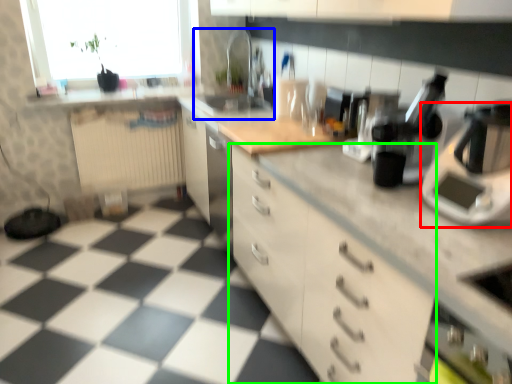
Question: Considering the real-world distances, which object is closest to home appliance (highlighted by a red box)? sink (highlighted by a blue box) or cabinetry (highlighted by a green box).

Choices:
 (A) sink
 (B) cabinetry

Answer: (B)